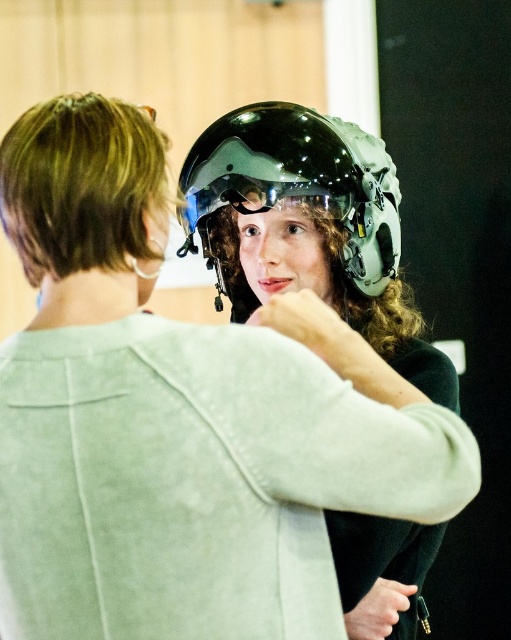
You are a delivery robot that needs to deliver a package to the person wearing the glossy black helmet at center. The minimum safe distance for delivery is 4 feet. Can you safely deliver the package to them?

The distance between the delivery robot and the person wearing the glossy black helmet at center is 3.90 feet, which is less than the required 4 feet minimum safe distance. Therefore, the delivery robot cannot safely deliver the package at this distance.

You are standing in the indoor setting shown in the image. There is a point at coordinates point (347, 241). Can you reach this point with your outstretched hand?

The point (347, 241) is 1.40 meters away from you. Since the average human arm length is about 0.7 meters, you cannot reach the point with your outstretched hand.